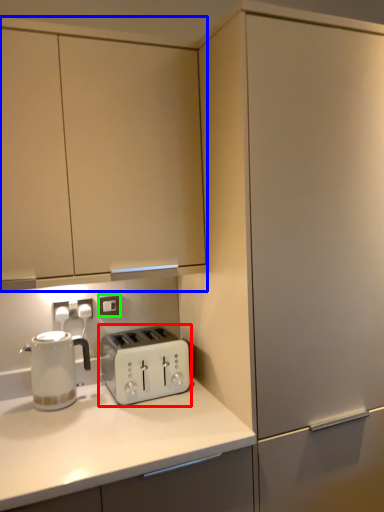
Question: Which object is positioned closest to toaster (highlighted by a red box)? Select from cabinetry (highlighted by a blue box) and electric outlet (highlighted by a green box).

Choices:
 (A) cabinetry
 (B) electric outlet

Answer: (B)